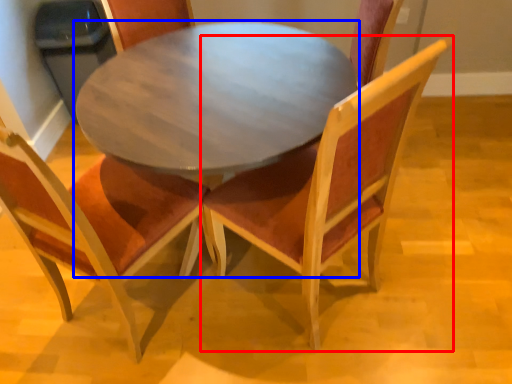
Question: Which object appears closest to the camera in this image, chair (highlighted by a red box) or coffee table (highlighted by a blue box)?

Choices:
 (A) chair
 (B) coffee table

Answer: (A)